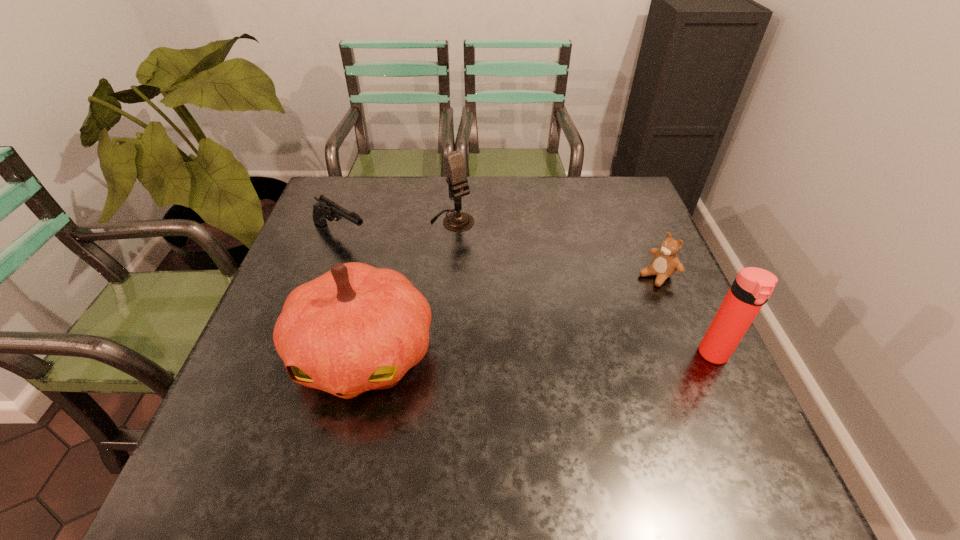
Identify the location of free area in between the third farthest object and the thermos bottle. (685, 315).

You are a GUI agent. You are given a task and a screenshot of the screen. Output one action in this format:
    pyautogui.click(x=<x>, y=<y>)
    Task: Click on the unoccupied position between the third nearest object and the pumpkin
    This screenshot has height=540, width=960.
    Given the screenshot: What is the action you would take?
    pyautogui.click(x=510, y=314)

Find the location of a particular element. This screenshot has height=540, width=960. free space between the pumpkin and the thermos bottle is located at coordinates (539, 354).

Identify the location of free space between the microphone and the third farthest object. The height and width of the screenshot is (540, 960). (555, 248).

Where is `empty space that is in between the microphone and the teddy bear`? The width and height of the screenshot is (960, 540). empty space that is in between the microphone and the teddy bear is located at coordinates (555, 248).

The image size is (960, 540). I want to click on unoccupied area between the thermos bottle and the pumpkin, so click(539, 354).

Where is `free space that is in between the microphone and the thermos bottle`? The height and width of the screenshot is (540, 960). free space that is in between the microphone and the thermos bottle is located at coordinates (584, 288).

You are a GUI agent. You are given a task and a screenshot of the screen. Output one action in this format:
    pyautogui.click(x=<x>, y=<y>)
    Task: Click on the object that is the second closest to the microphone
    This screenshot has height=540, width=960.
    Given the screenshot: What is the action you would take?
    pyautogui.click(x=356, y=328)

Choose which object is the second nearest neighbor to the third nearest object. Please provide its 2D coordinates. Your answer should be formatted as a tuple, i.e. [(x, y)], where the tuple contains the x and y coordinates of a point satisfying the conditions above.

[(455, 169)]

This screenshot has width=960, height=540. Find the location of `free location that satisfies the following two spatial constraints: 1. on the front-facing side of the pumpkin; 2. on the right side of the thermos bottle`. free location that satisfies the following two spatial constraints: 1. on the front-facing side of the pumpkin; 2. on the right side of the thermos bottle is located at coordinates (363, 355).